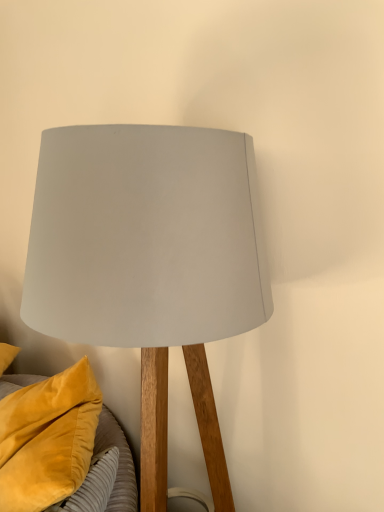
Question: Is matte gray lampshade at center beside velvet yellow pillow at lower left?

Choices:
 (A) no
 (B) yes

Answer: (A)

Question: From the image's perspective, would you say matte gray lampshade at center is shown under velvet yellow pillow at lower left?

Choices:
 (A) no
 (B) yes

Answer: (A)

Question: From the image's perspective, is matte gray lampshade at center located above velvet yellow pillow at lower left?

Choices:
 (A) yes
 (B) no

Answer: (A)

Question: Is the depth of matte gray lampshade at center greater than that of velvet yellow pillow at lower left?

Choices:
 (A) yes
 (B) no

Answer: (B)

Question: Considering the relative sizes of matte gray lampshade at center and velvet yellow pillow at lower left in the image provided, is matte gray lampshade at center thinner than velvet yellow pillow at lower left?

Choices:
 (A) no
 (B) yes

Answer: (A)

Question: Can you confirm if matte gray lampshade at center is shorter than velvet yellow pillow at lower left?

Choices:
 (A) yes
 (B) no

Answer: (B)

Question: Considering the relative positions of velvet yellow pillow at lower left and matte gray lampshade at center in the image provided, is velvet yellow pillow at lower left to the right of matte gray lampshade at center from the viewer's perspective?

Choices:
 (A) yes
 (B) no

Answer: (B)

Question: From the image's perspective, is velvet yellow pillow at lower left above matte gray lampshade at center?

Choices:
 (A) no
 (B) yes

Answer: (A)

Question: Considering the relative sizes of velvet yellow pillow at lower left and matte gray lampshade at center in the image provided, is velvet yellow pillow at lower left wider than matte gray lampshade at center?

Choices:
 (A) no
 (B) yes

Answer: (A)

Question: Can you confirm if velvet yellow pillow at lower left is taller than matte gray lampshade at center?

Choices:
 (A) yes
 (B) no

Answer: (B)

Question: Is velvet yellow pillow at lower left far from matte gray lampshade at center?

Choices:
 (A) no
 (B) yes

Answer: (A)

Question: From the image's perspective, does velvet yellow pillow at lower left appear lower than matte gray lampshade at center?

Choices:
 (A) yes
 (B) no

Answer: (A)

Question: Based on their sizes in the image, would you say matte gray lampshade at center is bigger or smaller than velvet yellow pillow at lower left?

Choices:
 (A) big
 (B) small

Answer: (A)